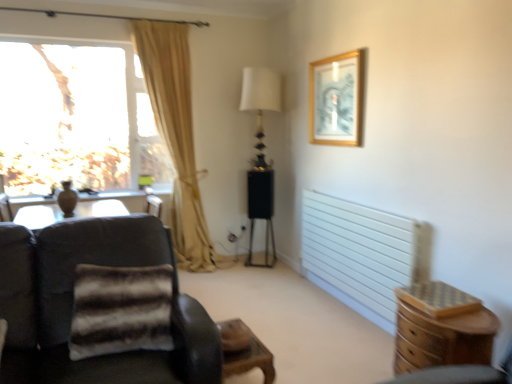
Describe the element at coordinates (260, 104) in the screenshot. I see `white glossy table lamp at center` at that location.

Image resolution: width=512 pixels, height=384 pixels. Describe the element at coordinates (75, 119) in the screenshot. I see `transparent glass window at upper left` at that location.

The image size is (512, 384). I want to click on dark brown leather chair at left, so click(x=72, y=305).

Identify the location of chest of drawers located on the right of beige fabric curtain at left. This screenshot has height=384, width=512. (441, 328).

From the image's perspective, does wooden chest of drawers at lower right appear higher than beige fabric curtain at left?

No.

How different are the orientations of wooden chest of drawers at lower right and beige fabric curtain at left in degrees?

There is a 92-degree angle between the facing directions of wooden chest of drawers at lower right and beige fabric curtain at left.

Which object is more forward, wooden side table at lower center or white matte radiator at right?

wooden side table at lower center is closer to the camera.

You are a GUI agent. You are given a task and a screenshot of the screen. Output one action in this format:
    pyautogui.click(x=<x>, y=<y>)
    Task: Click on the radiator that appears behind the wooden side table at lower center
    The height and width of the screenshot is (384, 512).
    Given the screenshot: What is the action you would take?
    pyautogui.click(x=358, y=254)

Based on the photo, considering the relative sizes of wooden side table at lower center and white matte radiator at right in the image provided, is wooden side table at lower center smaller than white matte radiator at right?

Correct, wooden side table at lower center occupies less space than white matte radiator at right.

From a real-world perspective, relative to white matte radiator at right, is wooden side table at lower center vertically above or below?

In terms of real-world spatial position, wooden side table at lower center is below white matte radiator at right.

Is white matte radiator at right to the left of transparent glass window at upper left from the viewer's perspective?

Incorrect, white matte radiator at right is not on the left side of transparent glass window at upper left.

Which object is more forward, white matte radiator at right or transparent glass window at upper left?

white matte radiator at right is closer to the camera.

Considering the sizes of white matte radiator at right and transparent glass window at upper left in the image, is white matte radiator at right taller or shorter than transparent glass window at upper left?

In the image, white matte radiator at right appears to be shorter than transparent glass window at upper left.

Find the location of a particular element. This screenshot has height=384, width=512. radiator below the beige fabric curtain at left (from the image's perspective) is located at coordinates (358, 254).

Is beige fabric curtain at left taller or shorter than white matte radiator at right?

In the image, beige fabric curtain at left appears to be taller than white matte radiator at right.

Is beige fabric curtain at left positioned with its back to white matte radiator at right?

beige fabric curtain at left does not have its back to white matte radiator at right.

Which is more to the right, beige fabric curtain at left or white matte radiator at right?

white matte radiator at right.

Is transparent glass window at upper left positioned far away from wooden side table at lower center?

Yes, transparent glass window at upper left and wooden side table at lower center are quite far apart.

Is wooden side table at lower center located within transparent glass window at upper left?

That's incorrect, wooden side table at lower center is not inside transparent glass window at upper left.

Considering the points (65, 119) and (251, 342), which point is in front, point (65, 119) or point (251, 342)?

The point (251, 342) is closer to the camera.

Is wooden chest of drawers at lower right next to white glossy table lamp at center?

No, wooden chest of drawers at lower right is not beside white glossy table lamp at center.

From a real-world perspective, is wooden chest of drawers at lower right above or below white glossy table lamp at center?

wooden chest of drawers at lower right is situated lower than white glossy table lamp at center in the real world.

Is wooden chest of drawers at lower right thinner than white glossy table lamp at center?

Indeed, wooden chest of drawers at lower right has a lesser width compared to white glossy table lamp at center.

Is wooden chest of drawers at lower right further to camera compared to white glossy table lamp at center?

No.

Considering the relative sizes of fuzzy fur pillow at lower left and transparent glass window at upper left in the image provided, is fuzzy fur pillow at lower left wider than transparent glass window at upper left?

Correct, the width of fuzzy fur pillow at lower left exceeds that of transparent glass window at upper left.

Is point (96, 301) positioned before point (118, 142)?

Yes, it is in front of point (118, 142).

From the image's perspective, would you say fuzzy fur pillow at lower left is positioned over transparent glass window at upper left?

Actually, fuzzy fur pillow at lower left appears below transparent glass window at upper left in the image.

From a real-world perspective, is fuzzy fur pillow at lower left positioned under transparent glass window at upper left based on gravity?

Correct, in the physical world, fuzzy fur pillow at lower left is lower than transparent glass window at upper left.

Where is `the chest of drawers lying below the beige fabric curtain at left (from the image's perspective)`? the chest of drawers lying below the beige fabric curtain at left (from the image's perspective) is located at coordinates (441, 328).

Find the location of a particular element. The height and width of the screenshot is (384, 512). side table in front of the white matte radiator at right is located at coordinates (244, 351).

When comparing their distances from gold-framed picture at upper right, does white glossy table lamp at center or dark brown leather chair at left seem closer?

Based on the image, white glossy table lamp at center appears to be nearer to gold-framed picture at upper right.

Estimate the real-world distances between objects in this image. Which object is further from white matte radiator at right, wooden chest of drawers at lower right or dark brown leather chair at left?

dark brown leather chair at left.

Which object lies nearer to the anchor point transparent glass window at upper left, dark brown leather chair at left or wooden side table at lower center?

Among the two, dark brown leather chair at left is located nearer to transparent glass window at upper left.

Estimate the real-world distances between objects in this image. Which object is closer to dark brown leather chair at left, white glossy table lamp at center or white matte radiator at right?

white matte radiator at right lies closer to dark brown leather chair at left than the other object.

Looking at this image, which object lies further to the anchor point fuzzy fur pillow at lower left, wooden side table at lower center or white matte radiator at right?

Based on the image, white matte radiator at right appears to be further to fuzzy fur pillow at lower left.

When comparing their distances from transparent glass window at upper left, does dark brown leather chair at left or fuzzy fur pillow at lower left seem further?

Among the two, fuzzy fur pillow at lower left is located further to transparent glass window at upper left.

Looking at the image, which one is located closer to white glossy table lamp at center, wooden side table at lower center or beige fabric curtain at left?

beige fabric curtain at left lies closer to white glossy table lamp at center than the other object.

Based on their spatial positions, is transparent glass window at upper left or dark brown leather chair at left further from beige fabric curtain at left?

dark brown leather chair at left lies further to beige fabric curtain at left than the other object.

Locate an element on the screen. This screenshot has height=384, width=512. table lamp situated between transparent glass window at upper left and white matte radiator at right from left to right is located at coordinates (260, 104).

The height and width of the screenshot is (384, 512). Identify the location of curtain located between fuzzy fur pillow at lower left and transparent glass window at upper left in the depth direction. (176, 134).

Where is `curtain between wooden side table at lower center and transparent glass window at upper left in the front-back direction`? The height and width of the screenshot is (384, 512). curtain between wooden side table at lower center and transparent glass window at upper left in the front-back direction is located at coordinates (176, 134).

This screenshot has width=512, height=384. In order to click on picture frame situated between transparent glass window at upper left and wooden chest of drawers at lower right from left to right in this screenshot , I will do `click(336, 100)`.